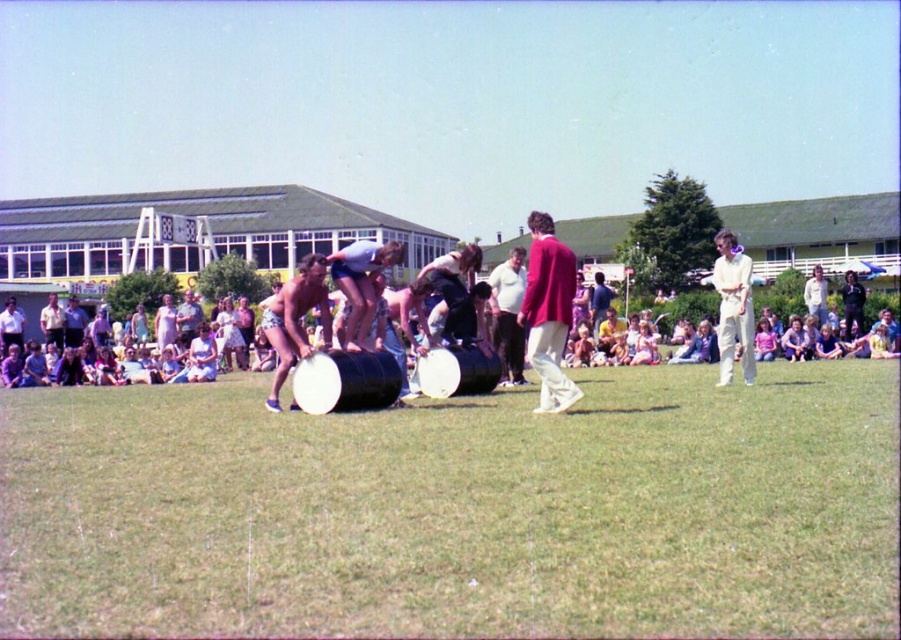
You are a photographer at the festival and want to capture a photo that includes both the white cotton shirt at right and the smooth black drum at center. Based on their positions, which object should you place on the left side of your photo to ensure both are in frame?

You should place the smooth black drum at center on the left side of your photo since the white cotton shirt at right is positioned on the right side of it, ensuring both objects are included in the frame.

You are standing at the center of the grassy field and want to reach the group participating in the drum game. According to the image, where exactly is the green grass at lower center located in relation to your current position?

The green grass at lower center is located at point (458, 509), so it is positioned to your lower center direction from your current position at the center of the grassy field.

You are organizing a photo shoot and need to place a 20 cm thick prop between the maroon fabric jacket at center and the smooth black drum at center. Can you fit it there?

The maroon fabric jacket at center is thinner than the smooth black drum at center, so the 20 cm thick prop may not fit between them if the space between them is narrower than 20 cm. However, without exact measurements of the space, it is uncertain.